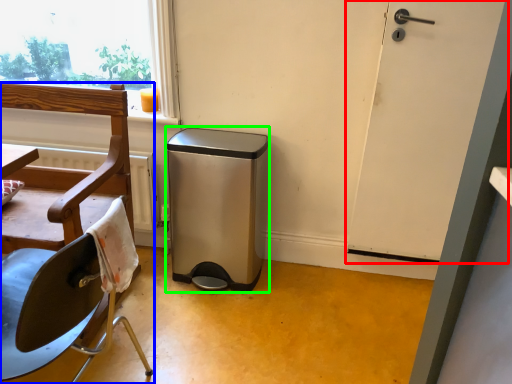
Question: Based on their relative distances, which object is nearer to door (highlighted by a red box)? Choose from chair (highlighted by a blue box) and dish washer (highlighted by a green box).

Choices:
 (A) chair
 (B) dish washer

Answer: (B)